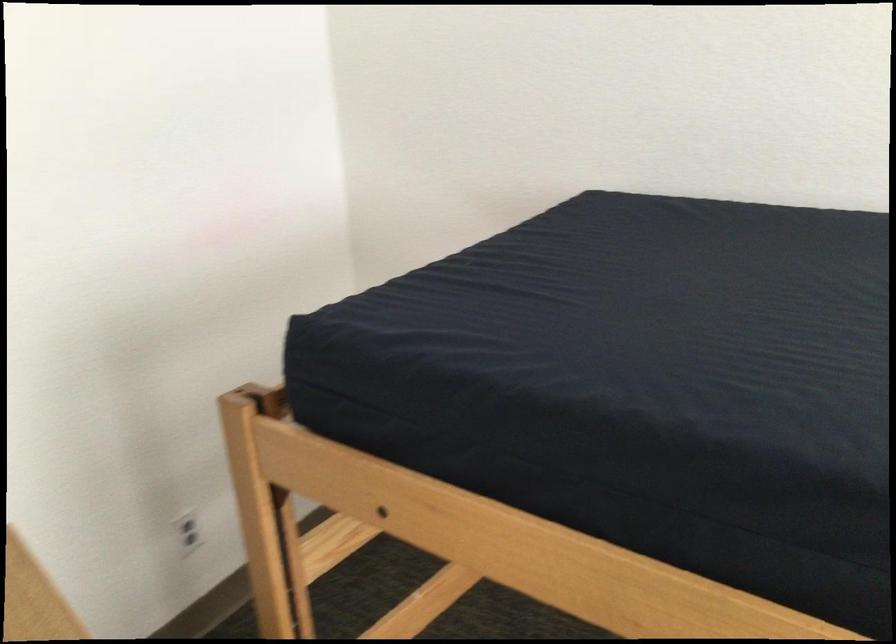
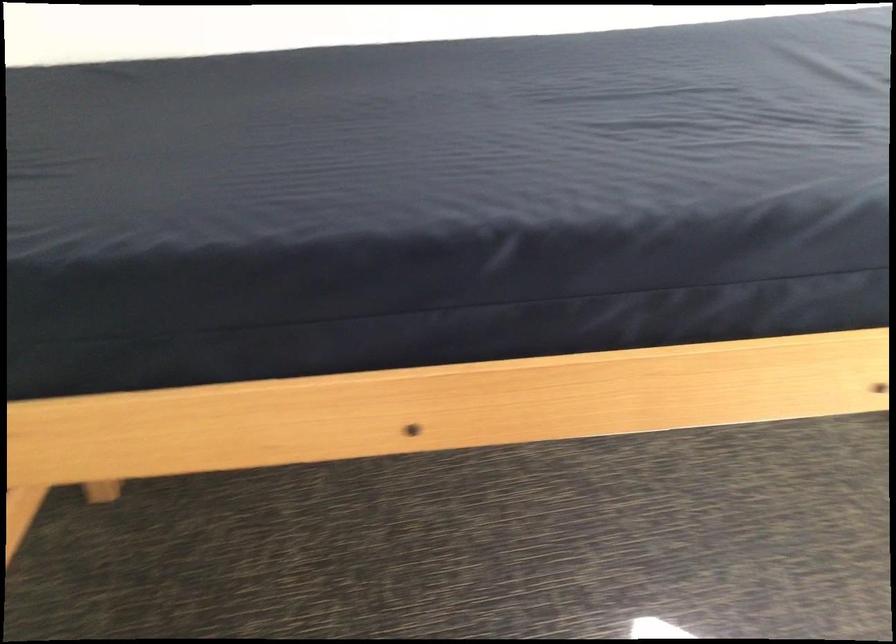
The point at (540, 558) is marked in the first image. Where is the corresponding point in the second image?

(165, 436)